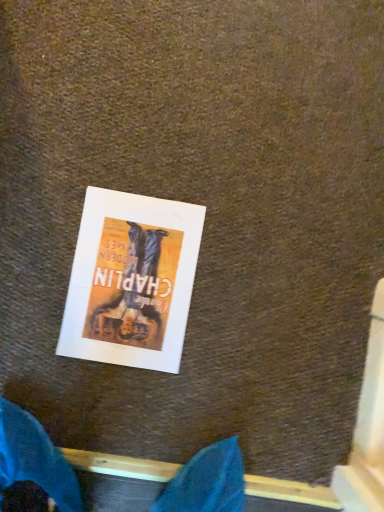
The width and height of the screenshot is (384, 512). I want to click on empty space that is ontop of matte paper poster at center (from a real-world perspective), so click(x=126, y=280).